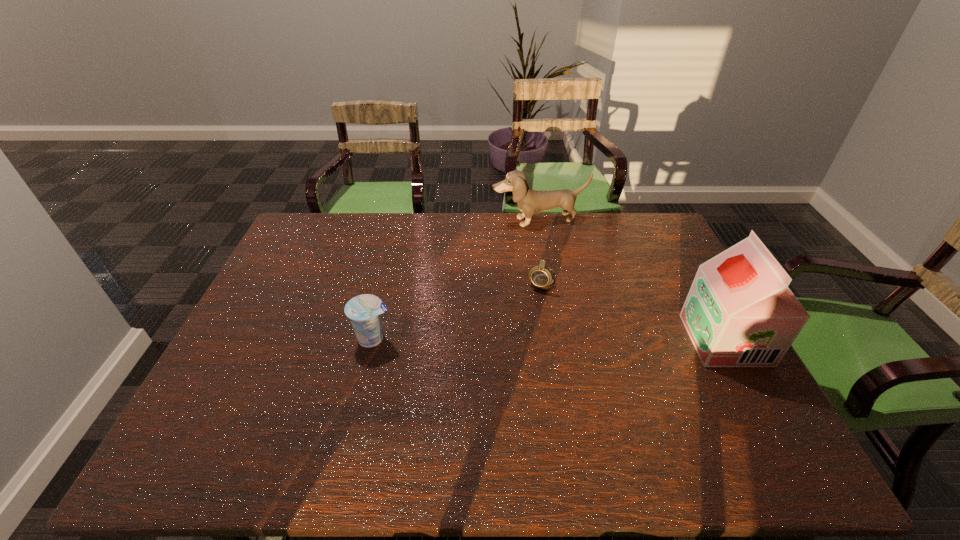
In the image, there is a desktop. Identify the location of free region at the left edge. (261, 321).

The width and height of the screenshot is (960, 540). Identify the location of vacant space at the right edge of the desktop. (681, 339).

What are the coordinates of `vacant space at the far left corner of the desktop` in the screenshot? It's located at (326, 222).

Locate an element on the screen. The width and height of the screenshot is (960, 540). free region at the far right corner of the desktop is located at coordinates (625, 219).

You are a GUI agent. You are given a task and a screenshot of the screen. Output one action in this format:
    pyautogui.click(x=<x>, y=<y>)
    Task: Click on the free space between the second tallest object and the yogurt
    This screenshot has height=540, width=960.
    Given the screenshot: What is the action you would take?
    pyautogui.click(x=456, y=279)

Image resolution: width=960 pixels, height=540 pixels. What are the coordinates of `unoccupied area between the yogurt and the tallest object` in the screenshot? It's located at (549, 339).

In order to click on free space between the leftmost object and the farthest object in this screenshot , I will do `click(456, 279)`.

I want to click on vacant space that is in between the third shortest object and the rightmost object, so click(x=632, y=280).

Identify the location of free space between the leftmost object and the farthest object. (456, 279).

The height and width of the screenshot is (540, 960). Identify the location of vacant area that lies between the third shortest object and the compass. (540, 251).